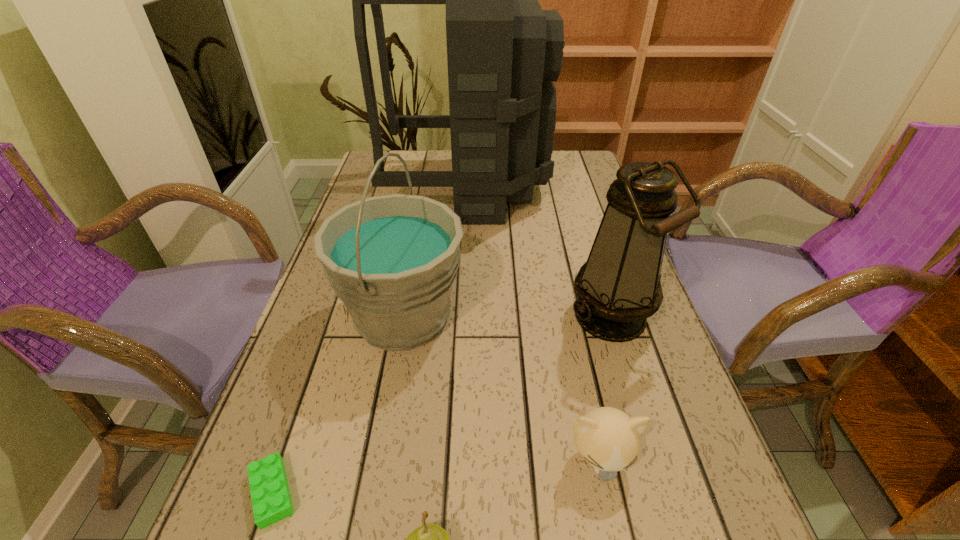
Find the location of a particular element. backpack is located at coordinates point(503,51).

The width and height of the screenshot is (960, 540). Identify the location of the farthest object. (503, 51).

Identify the location of bucket. The width and height of the screenshot is (960, 540). (392, 260).

Find the location of `oil lamp`. oil lamp is located at coordinates (618, 288).

This screenshot has height=540, width=960. I want to click on kitten, so pos(608,439).

Find the location of a particular element. Lego is located at coordinates (271, 500).

Where is `free space located 0.080m on the front compartment of the farthest object`? free space located 0.080m on the front compartment of the farthest object is located at coordinates (571, 187).

What are the coordinates of `free space located 0.170m on the back of the bucket` in the screenshot? It's located at [x=419, y=233].

Image resolution: width=960 pixels, height=540 pixels. I want to click on free location located 0.220m on the left of the oil lamp, so click(x=463, y=317).

Identify the location of vacant area situated 0.070m on the face of the kitten. Image resolution: width=960 pixels, height=540 pixels. (617, 539).